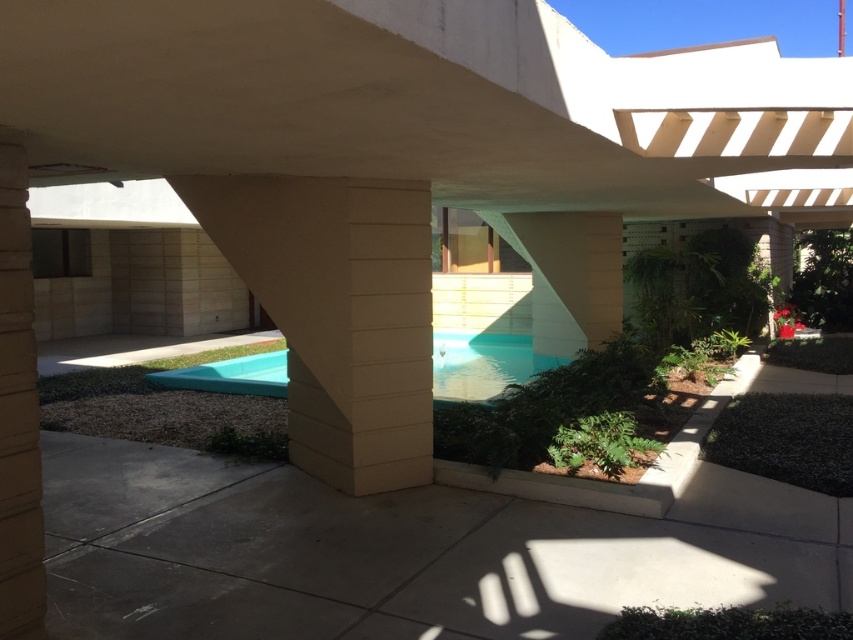
Is beige textured pillar at center thinner than light blue smooth pool at center?

Yes.

Between beige textured pillar at center and light blue smooth pool at center, which one has less height?

Standing shorter between the two is light blue smooth pool at center.

Is point (401, 312) less distant than point (242, 387)?

That is True.

I want to click on beige textured pillar at center, so click(338, 314).